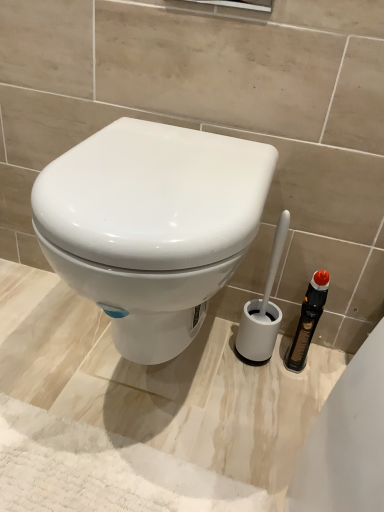
Question: Should I look upward or downward to see white glossy toilet at center?

Choices:
 (A) up
 (B) down

Answer: (B)

Question: Can you confirm if white glossy toilet at center is taller than white plastic toilet brush at right?

Choices:
 (A) yes
 (B) no

Answer: (A)

Question: Does white glossy toilet at center appear on the right side of white plastic toilet brush at right?

Choices:
 (A) yes
 (B) no

Answer: (B)

Question: Is white glossy toilet at center at the left side of white plastic toilet brush at right?

Choices:
 (A) yes
 (B) no

Answer: (A)

Question: From a real-world perspective, is white glossy toilet at center on top of white plastic toilet brush at right?

Choices:
 (A) no
 (B) yes

Answer: (B)

Question: Is white glossy toilet at center facing towards white plastic toilet brush at right?

Choices:
 (A) yes
 (B) no

Answer: (B)

Question: Can you confirm if white glossy toilet at center is smaller than white plastic toilet brush at right?

Choices:
 (A) yes
 (B) no

Answer: (B)

Question: From a real-world perspective, is white plastic toilet brush at right physically below white glossy toilet at center?

Choices:
 (A) no
 (B) yes

Answer: (B)

Question: Could you tell me if white plastic toilet brush at right is turned towards white glossy toilet at center?

Choices:
 (A) no
 (B) yes

Answer: (A)

Question: Considering the relative sizes of white plastic toilet brush at right and white glossy toilet at center in the image provided, is white plastic toilet brush at right wider than white glossy toilet at center?

Choices:
 (A) yes
 (B) no

Answer: (B)

Question: Is the position of white plastic toilet brush at right more distant than that of white glossy toilet at center?

Choices:
 (A) no
 (B) yes

Answer: (B)

Question: Does white plastic toilet brush at right have a lesser height compared to white glossy toilet at center?

Choices:
 (A) no
 (B) yes

Answer: (B)

Question: Is white plastic toilet brush at right not close to white glossy toilet at center?

Choices:
 (A) yes
 (B) no

Answer: (B)

Question: Which is correct: white plastic toilet brush at right is inside white glossy toilet at center, or outside of it?

Choices:
 (A) inside
 (B) outside

Answer: (B)